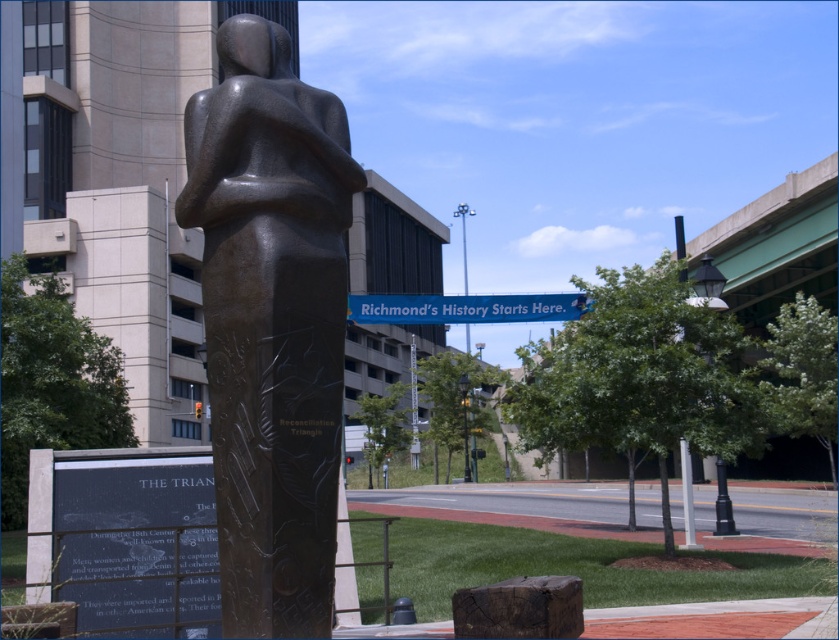
You are standing 5 meters away from the bronze statue at center. Can you get a clear photo of it without moving closer?

The bronze statue at center and camera are 5.36 meters apart, so you are currently 0.36 meters too far away to get a clear photo without moving closer.